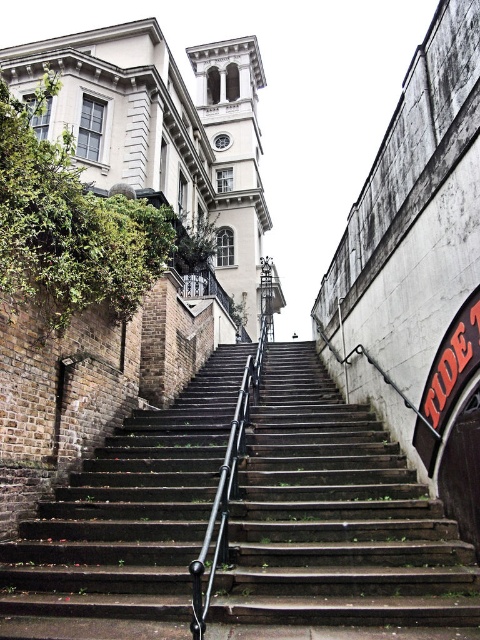
Question: Which of the following is the farthest from the observer?

Choices:
 (A) (217, 552)
 (B) (312, 392)

Answer: (B)

Question: Does dark brown wooden stairs at center lie in front of black metal/rail at center?

Choices:
 (A) no
 (B) yes

Answer: (A)

Question: Which of the following is the farthest from the observer?

Choices:
 (A) (216, 561)
 (B) (60, 588)

Answer: (B)

Question: Is dark brown wooden stairs at center to the right of black metal/rail at center from the viewer's perspective?

Choices:
 (A) no
 (B) yes

Answer: (A)

Question: Does dark brown wooden stairs at center appear on the right side of black metal/rail at center?

Choices:
 (A) no
 (B) yes

Answer: (A)